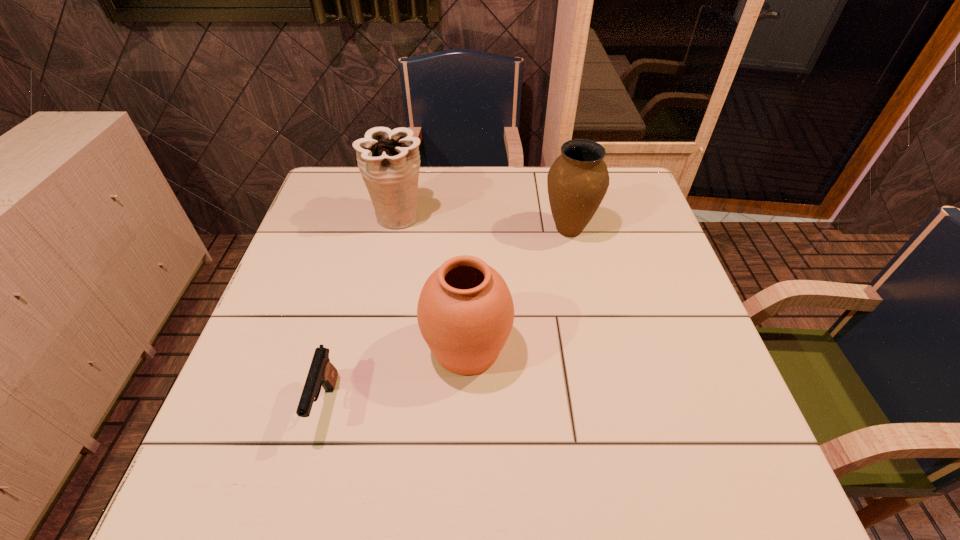
Where is `free space at the near edge of the desktop`? Image resolution: width=960 pixels, height=540 pixels. free space at the near edge of the desktop is located at coordinates (660, 470).

Image resolution: width=960 pixels, height=540 pixels. In the image, there is a desktop. What are the coordinates of `vacant space at the left edge` in the screenshot? It's located at (256, 354).

Find the location of a particular element. Image resolution: width=960 pixels, height=540 pixels. vacant space at the right edge of the desktop is located at coordinates (641, 226).

Image resolution: width=960 pixels, height=540 pixels. I want to click on vacant position at the near right corner of the desktop, so click(x=727, y=475).

I want to click on empty space between the shortest object and the second urn from left to right, so coord(396,376).

The image size is (960, 540). I want to click on vacant space that is in between the second object from right to left and the shortest object, so click(396, 376).

Image resolution: width=960 pixels, height=540 pixels. Find the location of `free area in between the second object from right to left and the shortest object`. free area in between the second object from right to left and the shortest object is located at coordinates (396, 376).

The width and height of the screenshot is (960, 540). I want to click on unoccupied position between the rightmost object and the leftmost urn, so click(x=484, y=222).

At what (x,y) coordinates should I click in order to perform the action: click on vacant point located between the leftmost urn and the pistol. Please return your answer as a coordinate pair (x, y). Looking at the image, I should click on (362, 310).

I want to click on free space between the leftmost urn and the rightmost object, so click(484, 222).